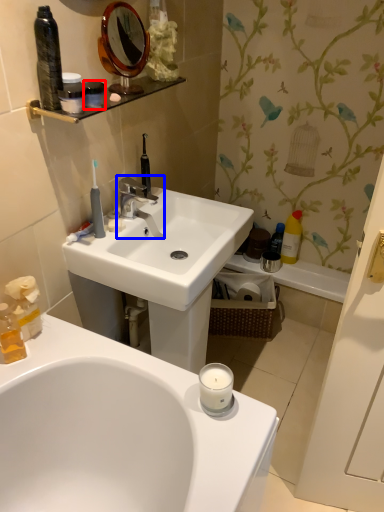
Question: Which object appears farthest to the camera in this image, mouthwash (highlighted by a red box) or tap (highlighted by a blue box)?

Choices:
 (A) mouthwash
 (B) tap

Answer: (B)